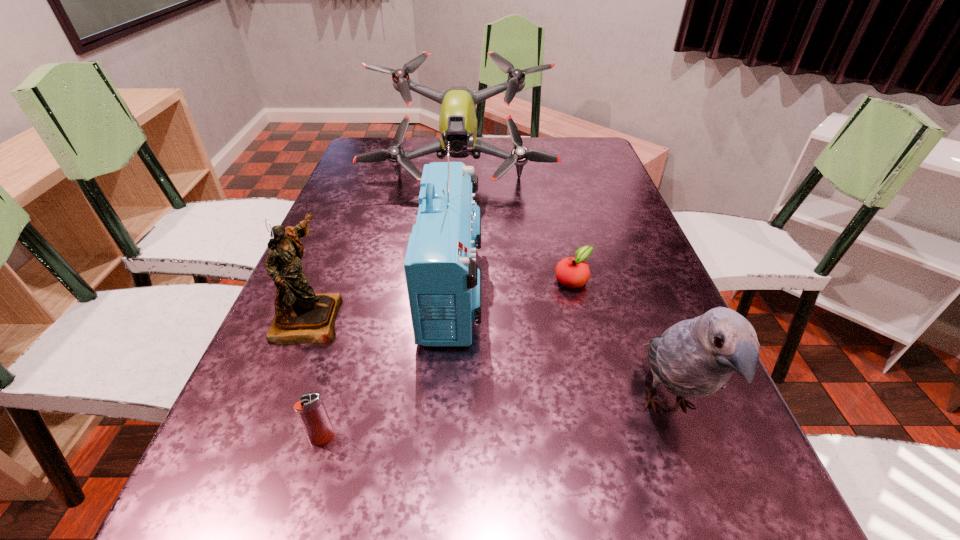
Identify the location of vacant area at the left edge of the desktop. The width and height of the screenshot is (960, 540). (375, 195).

Locate an element on the screen. This screenshot has width=960, height=540. free space at the right edge is located at coordinates (618, 235).

The image size is (960, 540). In order to click on free space between the rightmost object and the figurine in this screenshot , I will do `click(489, 362)`.

Identify the location of vacant space that's between the second shortest object and the figurine. Image resolution: width=960 pixels, height=540 pixels. (316, 377).

Where is `free space between the parrot and the apple`? free space between the parrot and the apple is located at coordinates (620, 343).

The width and height of the screenshot is (960, 540). What are the coordinates of `unoccupied position between the figurine and the drone` in the screenshot? It's located at (384, 244).

What are the coordinates of `vacant space that's between the radio receiver and the second shortest object` in the screenshot? It's located at (388, 363).

You are a GUI agent. You are given a task and a screenshot of the screen. Output one action in this format:
    pyautogui.click(x=<x>, y=<y>)
    Task: Click on the empty space between the apple and the parrot
    The image size is (960, 540).
    Given the screenshot: What is the action you would take?
    pyautogui.click(x=620, y=343)

The height and width of the screenshot is (540, 960). I want to click on vacant space that's between the apple and the radio receiver, so click(513, 284).

Where is `free space between the farthest object and the figurine`? free space between the farthest object and the figurine is located at coordinates (384, 244).